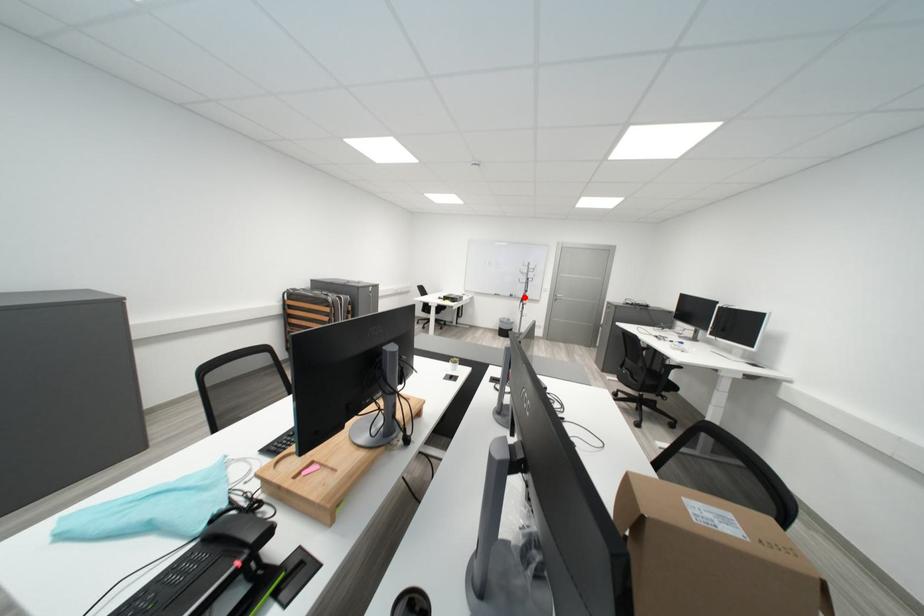
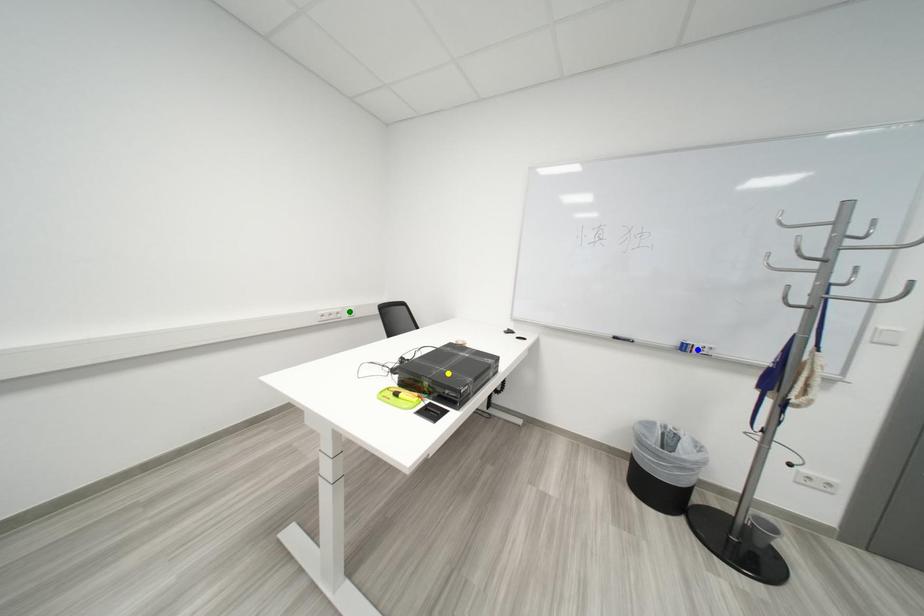
Question: I am providing you with two images of the same scene from different viewpoints. A red point is marked on the first image. You are given multiple points on the second image. Can you choose the point in image 2 that corresponds to the point in image 1?

Choices:
 (A) yellow point
 (B) green point
 (C) blue point

Answer: (C)